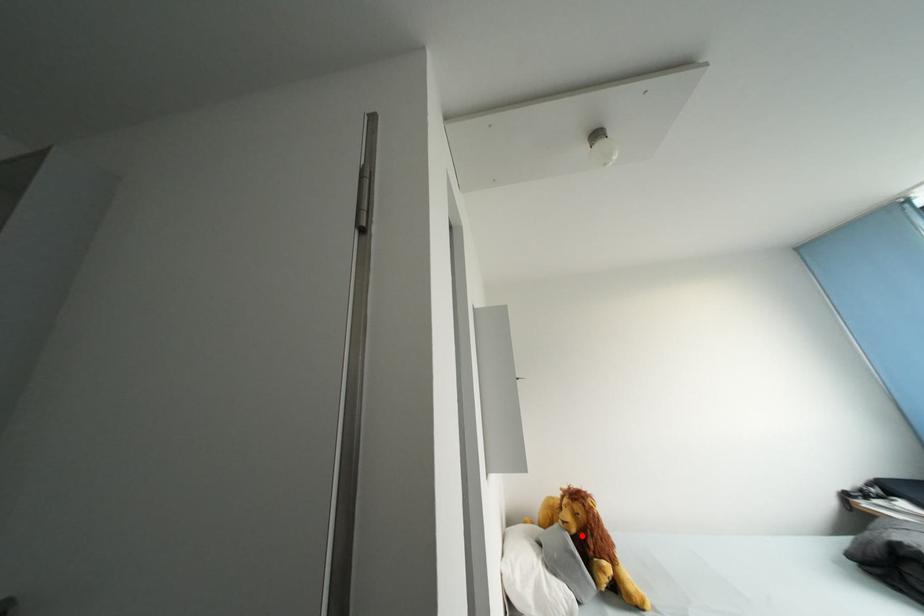
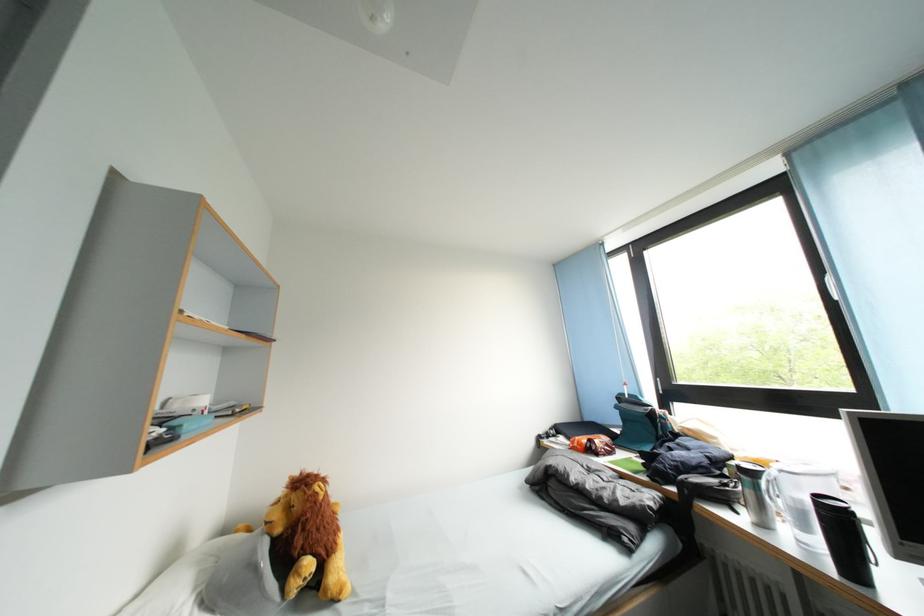
Locate, in the second image, the point that corresponds to the highlighted location in the first image.

(287, 535)